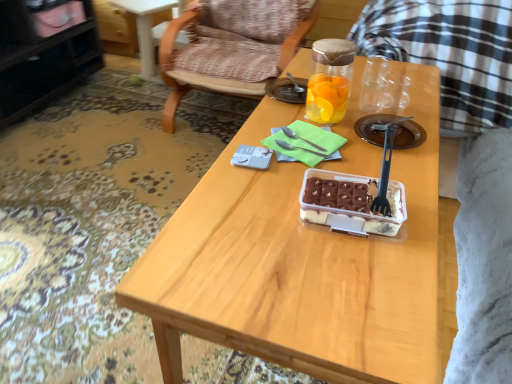
Where is `spots to the right of satin silver fork at center, which appears as the first fork when viewed from the back`? The width and height of the screenshot is (512, 384). spots to the right of satin silver fork at center, which appears as the first fork when viewed from the back is located at coordinates (366, 141).